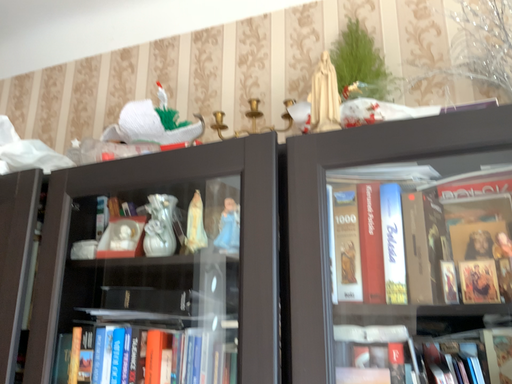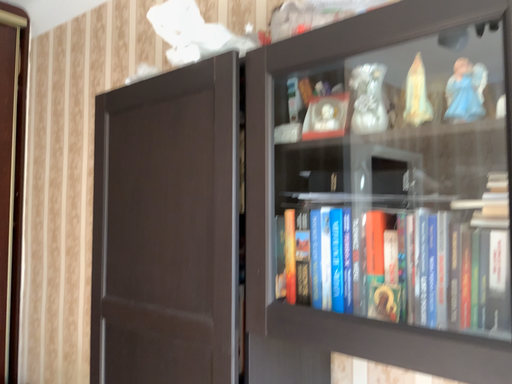
Question: Which way did the camera rotate in the video?

Choices:
 (A) rotated upward
 (B) rotated downward

Answer: (B)